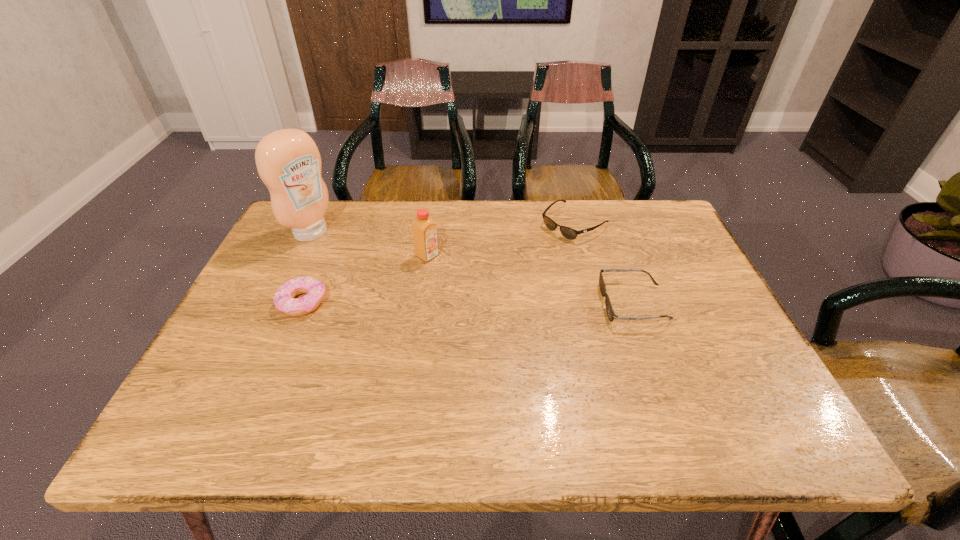
I want to click on free space between the nearer sunglasses and the doughnut, so click(x=468, y=303).

This screenshot has width=960, height=540. What are the coordinates of `vacant area that lies between the nearer sunglasses and the fourth shortest object` in the screenshot? It's located at pyautogui.click(x=530, y=279).

You are a GUI agent. You are given a task and a screenshot of the screen. Output one action in this format:
    pyautogui.click(x=<x>, y=<y>)
    Task: Click on the free space between the condiment and the doughnut
    
    Given the screenshot: What is the action you would take?
    pyautogui.click(x=307, y=267)

Where is `free spot between the nearer sunglasses and the farther sunglasses`? free spot between the nearer sunglasses and the farther sunglasses is located at coordinates (604, 263).

You are a GUI agent. You are given a task and a screenshot of the screen. Output one action in this format:
    pyautogui.click(x=<x>, y=<y>)
    Task: Click on the vacant space that is in between the farther sunglasses and the third object from right to left
    The height and width of the screenshot is (540, 960).
    Given the screenshot: What is the action you would take?
    pyautogui.click(x=500, y=239)

You are a GUI agent. You are given a task and a screenshot of the screen. Output one action in this format:
    pyautogui.click(x=<x>, y=<y>)
    Task: Click on the vacant space in between the farther sunglasses and the orange juice
    Image resolution: width=960 pixels, height=540 pixels.
    Given the screenshot: What is the action you would take?
    pyautogui.click(x=500, y=239)

Locate an element on the screen. empty space between the orange juice and the condiment is located at coordinates (369, 244).

Locate an element on the screen. The width and height of the screenshot is (960, 540). vacant point located between the tallest object and the doughnut is located at coordinates (307, 267).

Find the location of a particular element. vacant area that lies between the farther sunglasses and the doughnut is located at coordinates (439, 263).

The height and width of the screenshot is (540, 960). Find the location of `free space between the condiment and the doughnut`. free space between the condiment and the doughnut is located at coordinates (307, 267).